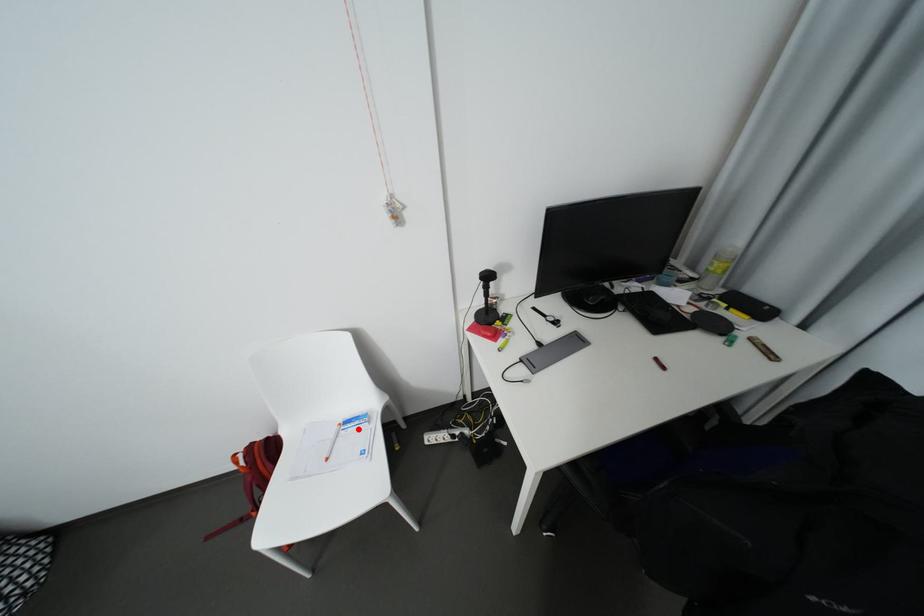
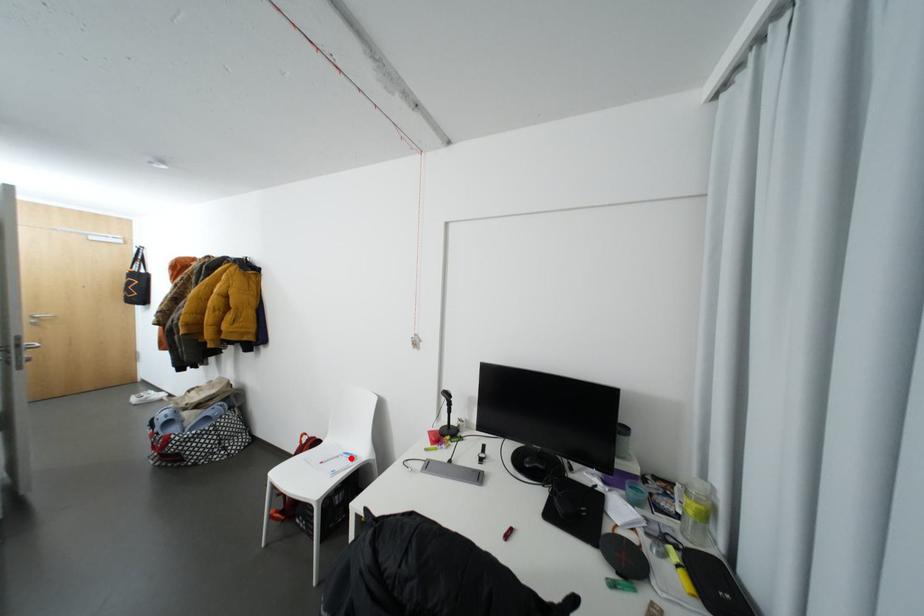
I am providing you with two images of the same scene from different viewpoints. A red point is marked on the first image and another point is marked on the second image. Is the red point in image1 aligned with the point shown in image2?

Yes